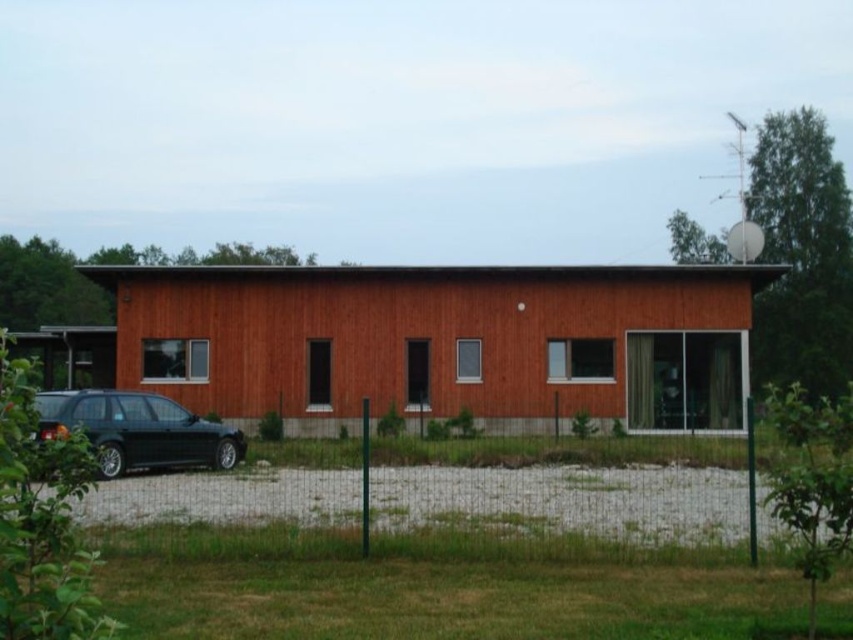
You are a visitor arriving at the wooden house and notice the wooden barn at center and the shiny dark gray car at lower left. Which object is taller from your perspective?

The wooden barn at center is taller than the shiny dark gray car at lower left according to the description.

You are standing in front of the wooden barn at center and want to drive your shiny dark gray car at lower left to the main road. Is the car currently positioned in a way that allows you to drive straight forward without moving around the barn?

The shiny dark gray car at lower left is behind the wooden barn at center, so you cannot drive straight forward to the main road without moving around the barn first.